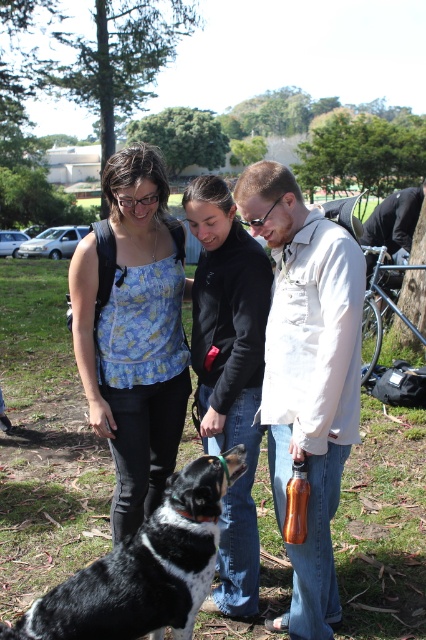
You are trying to decide which person to approach first between the matte white shirt at center and the black matte jacket at center. Based on their positions, which one is closer to you?

The matte white shirt at center is closer to the viewer than the black matte jacket at center, so you should approach the matte white shirt at center first.

You are planning to take a photo of the matte white shirt at center in the park scene. To ensure the shirt is well lit, where should you position yourself relative to the bright sky? Please consider the position of the shirt and the lighting direction.

The matte white shirt at center is located at point [307,372]. To ensure proper lighting, position yourself so the bright sky is behind you, facing the shirt directly. This will illuminate the shirt evenly without harsh shadows.

You are a photographer positioned in the park and want to capture a photo of the matte floral tank top at center and the black and white fur at center. Which object should you focus on first to ensure both are in focus?

You should focus on the matte floral tank top at center first because it is closer to you than the black and white fur at center, so focusing on it will help ensure both are in focus.